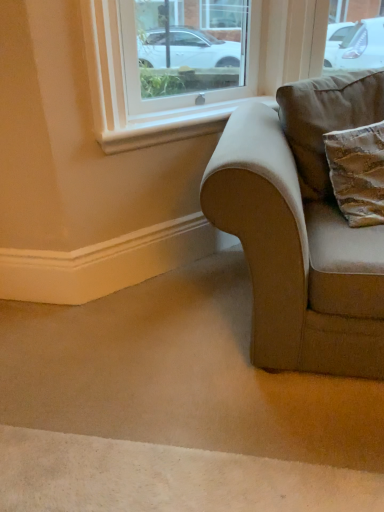
Question: Is velvet beige couch at lower right to the left or to the right of white smooth window sill at upper center in the image?

Choices:
 (A) right
 (B) left

Answer: (A)

Question: From the image's perspective, is velvet beige couch at lower right positioned above or below white smooth window sill at upper center?

Choices:
 (A) above
 (B) below

Answer: (B)

Question: Which is nearer to the velvet beige couch at lower right?

Choices:
 (A) brown suede pillow at right
 (B) white smooth window sill at upper center

Answer: (A)

Question: Estimate the real-world distances between objects in this image. Which object is closer to the velvet beige couch at lower right?

Choices:
 (A) white smooth window sill at upper center
 (B) brown suede pillow at right

Answer: (B)